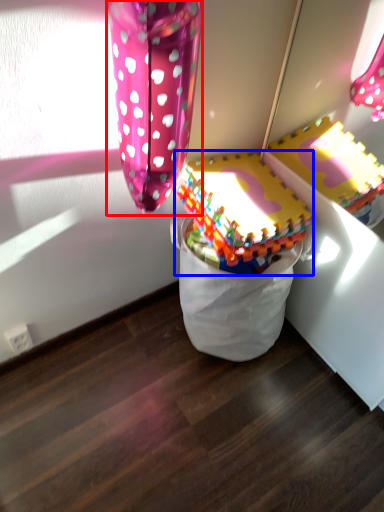
Question: Which object appears farthest to the camera in this image, balloon (highlighted by a red box) or toy (highlighted by a blue box)?

Choices:
 (A) balloon
 (B) toy

Answer: (B)